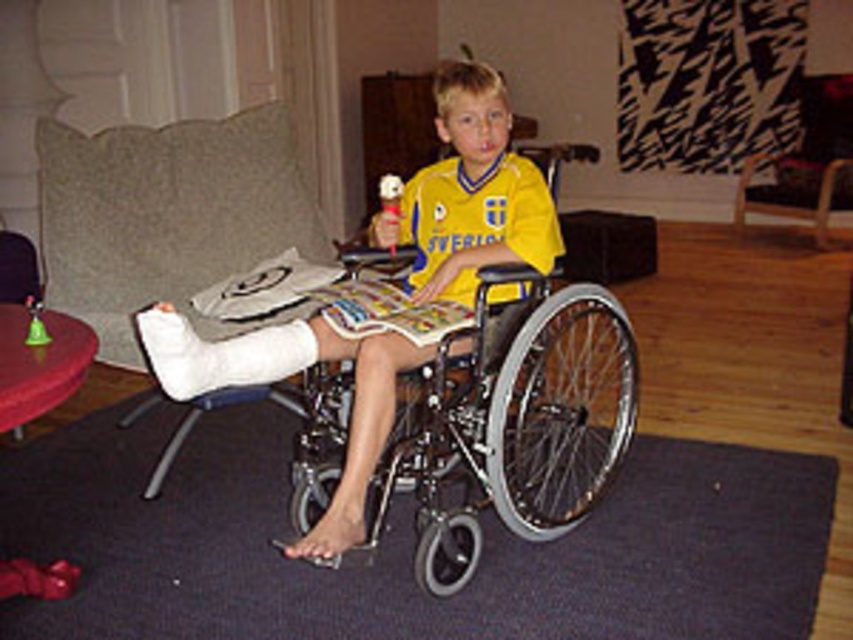
Looking at this image, you are a physical therapist visiting a patient in their home. You need to place a therapy tool on the floor near the silver metallic wheelchair at center so that it is within easy reach. Considering the typical height of a wheelchair, is the tool likely to be within arm reach if placed 2.26 meters away from the patient?

The silver metallic wheelchair at center is 2.26 meters away from the viewer. Since the tool is placed at this distance, it would be too far for the patient to reach with their arms. The typical arm reach from a wheelchair is about 1 meter, so placing the tool 2.26 meters away would make it out of reach.